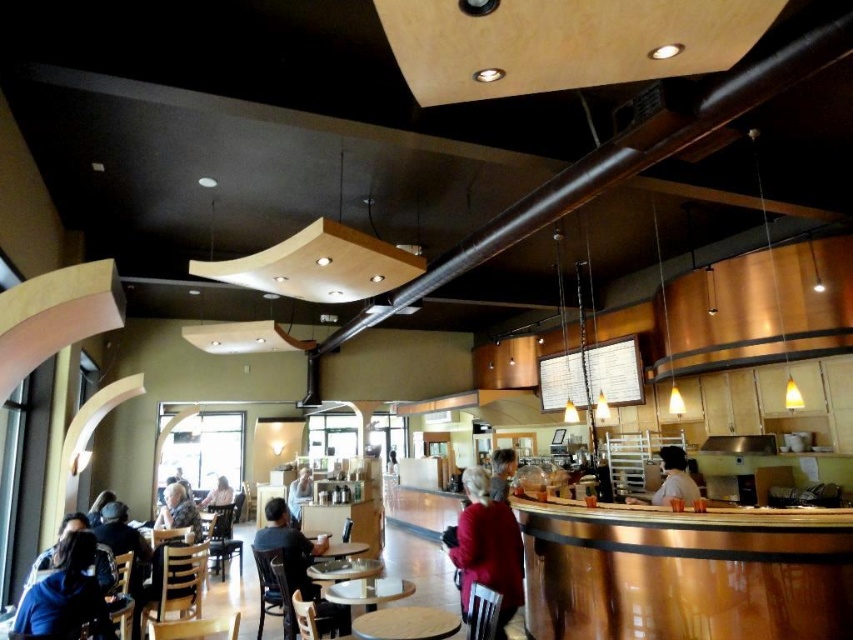
Can you confirm if matte red coat at center is taller than light brown wooden table at center?

Yes.

Where is `matte red coat at center`? The height and width of the screenshot is (640, 853). matte red coat at center is located at coordinates (486, 547).

Which of these two, wooden round table at center or dark gray sweater at center, stands taller?

wooden round table at center is taller.

Does wooden round table at center appear on the right side of dark gray sweater at center?

Yes, wooden round table at center is to the right of dark gray sweater at center.

Identify the location of wooden round table at center. Image resolution: width=853 pixels, height=640 pixels. click(x=368, y=589).

Does matte black jacket at lower left appear over white fabric shirt at counter?

Actually, matte black jacket at lower left is below white fabric shirt at counter.

Looking at this image, is matte black jacket at lower left behind white fabric shirt at counter?

No, it is not.

Between point (45, 609) and point (677, 493), which one is positioned behind?

Positioned behind is point (677, 493).

Where is `matte black jacket at lower left`? This screenshot has height=640, width=853. matte black jacket at lower left is located at coordinates (65, 596).